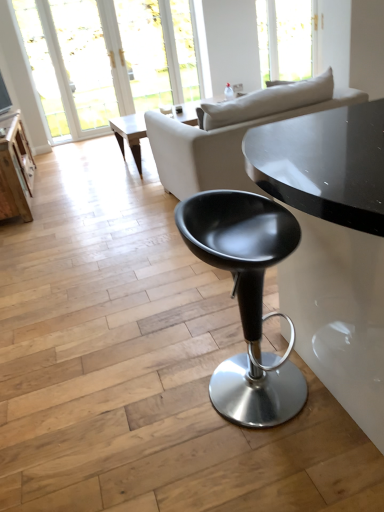
Question: Is white fabric couch at upper center inside the boundaries of wooden table at left, or outside?

Choices:
 (A) inside
 (B) outside

Answer: (B)

Question: Is white fabric couch at upper center wider or thinner than wooden table at left?

Choices:
 (A) thin
 (B) wide

Answer: (B)

Question: Estimate the real-world distances between objects in this image. Which object is farther from the wooden table at left?

Choices:
 (A) matte black stool at center
 (B) transparent glass window at upper center
 (C) white fabric couch at upper center
 (D) light wood coffee table at center
 (E) transparent glass door at upper left

Answer: (B)

Question: Which object is positioned closest to the white fabric couch at upper center?

Choices:
 (A) matte black stool at center
 (B) light wood coffee table at center
 (C) transparent glass door at upper left
 (D) wooden table at left
 (E) transparent glass window at upper center

Answer: (A)